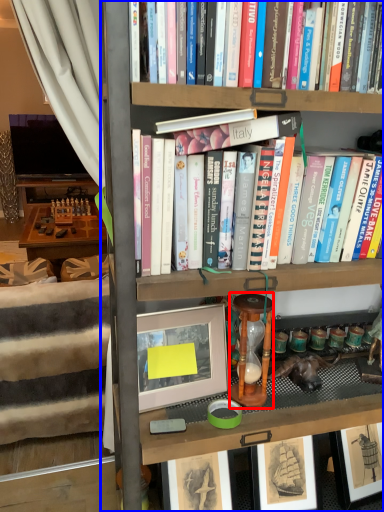
Question: Which point is further to the camera, stool (highlighted by a red box) or bookcase (highlighted by a blue box)?

Choices:
 (A) stool
 (B) bookcase

Answer: (A)